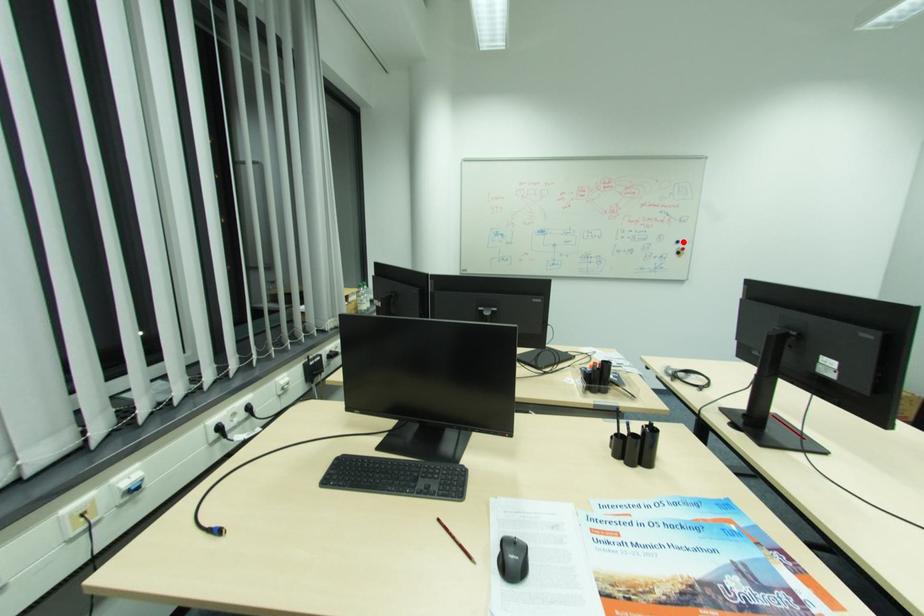
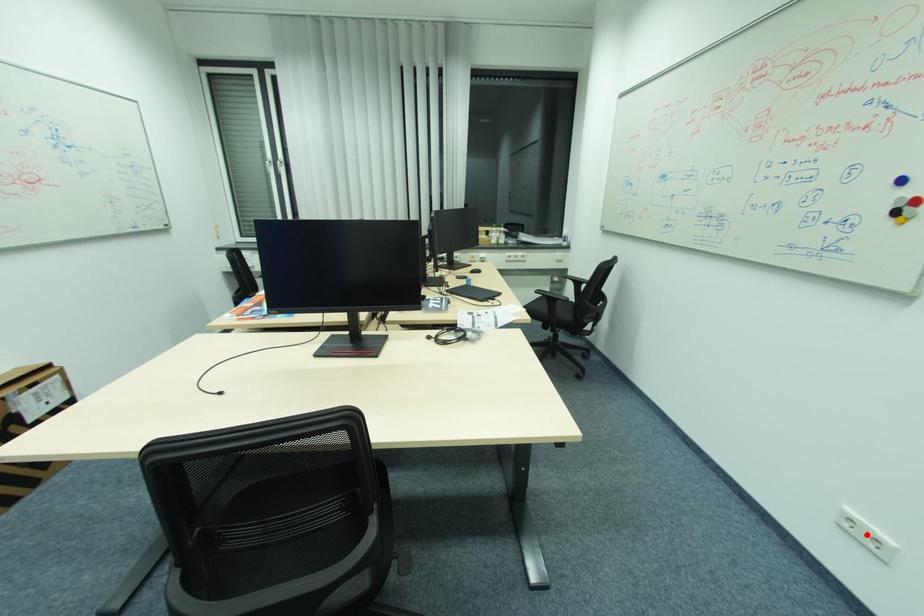
I am providing you with two images of the same scene from different viewpoints. A red point is marked on the first image and another point is marked on the second image. Is the marked point in image1 the same physical position as the marked point in image2?

No